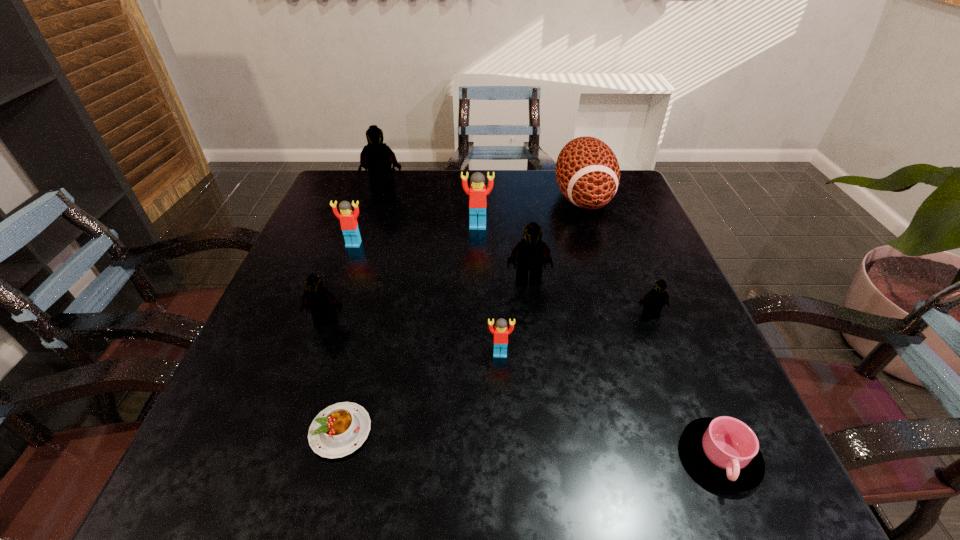
I want to click on the nearest Lego, so click(501, 331).

The height and width of the screenshot is (540, 960). Find the location of `the eighth farthest object`. the eighth farthest object is located at coordinates (501, 331).

The width and height of the screenshot is (960, 540). I want to click on the rightmost Lego, so click(x=654, y=300).

This screenshot has width=960, height=540. I want to click on the rightmost black Lego, so click(x=654, y=300).

Identify the location of cup. (724, 451).

At what (x,y) coordinates should I click in order to perform the action: click on pink cup. Please return your answer as a coordinate pair (x, y). This screenshot has height=540, width=960. Looking at the image, I should click on (724, 451).

This screenshot has width=960, height=540. What are the coordinates of `the shortest object` in the screenshot? It's located at [340, 429].

Locate an element on the screen. The image size is (960, 540). vacant space situated 0.330m on the face of the farthest Lego is located at coordinates (358, 267).

The height and width of the screenshot is (540, 960). In order to click on free space located 0.050m on the front of the football in this screenshot , I will do click(596, 241).

Where is `vacant area located 0.150m on the face of the farthest red Lego`? vacant area located 0.150m on the face of the farthest red Lego is located at coordinates (478, 269).